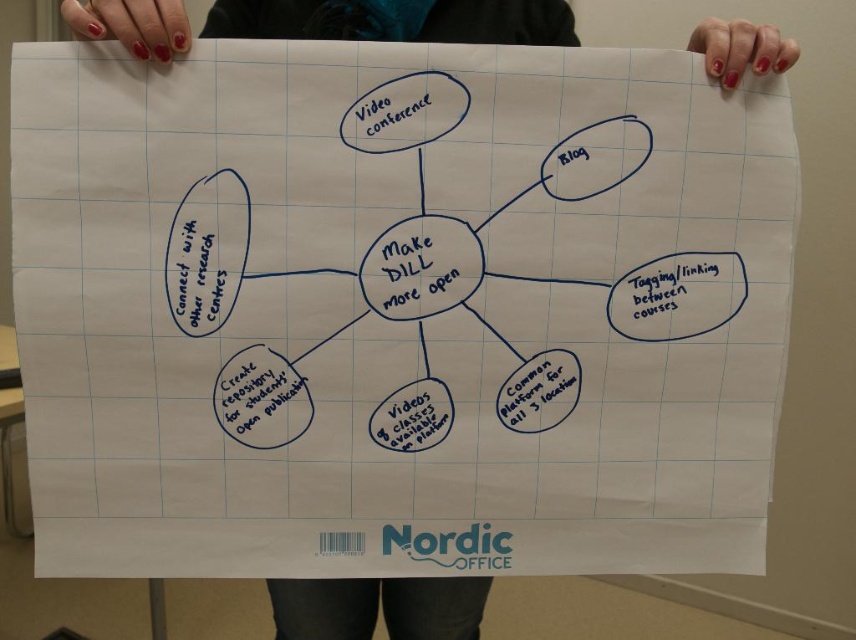
Is black handwritten text at upper left above matte blue text at upper center?

Incorrect, black handwritten text at upper left is not positioned above matte blue text at upper center.

What do you see at coordinates (200, 273) in the screenshot? Image resolution: width=856 pixels, height=640 pixels. I see `black handwritten text at upper left` at bounding box center [200, 273].

The image size is (856, 640). Identify the location of black handwritten text at upper left. (200, 273).

Where is `black handwritten text at upper left`? The width and height of the screenshot is (856, 640). black handwritten text at upper left is located at coordinates (200, 273).

Looking at this image, can you confirm if black handwritten text at upper right is positioned to the right of black handwritten text at upper left?

Indeed, black handwritten text at upper right is positioned on the right side of black handwritten text at upper left.

Based on the photo, who is positioned more to the right, black handwritten text at upper right or black handwritten text at upper left?

Positioned to the right is black handwritten text at upper right.

Between point (682, 259) and point (195, 285), which one is positioned in front?

Point (195, 285)

Identify the location of black handwritten text at upper right. The image size is (856, 640). (676, 292).

Can you confirm if black handwritten text at upper right is taller than matte blue text at upper center?

Yes.

Does point (712, 284) lie behind point (396, 113)?

Yes.

At what (x,y) coordinates should I click in order to perform the action: click on black handwritten text at upper right. Please return your answer as a coordinate pair (x, y). Image resolution: width=856 pixels, height=640 pixels. Looking at the image, I should click on (676, 292).